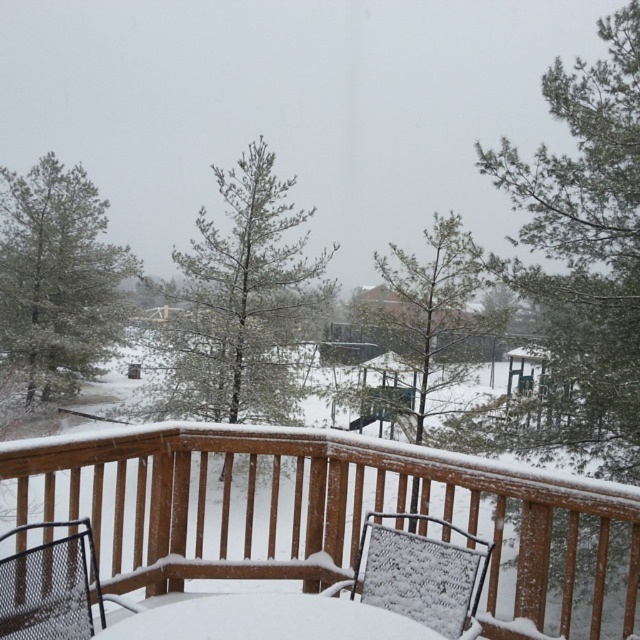
Does green matte tree at upper right appear under white mesh chair at center?

No.

Is green matte tree at upper right shorter than white mesh chair at center?

Correct, green matte tree at upper right is not as tall as white mesh chair at center.

I want to click on green matte tree at upper right, so click(x=586, y=244).

Is point (266, 452) less distant than point (81, 580)?

No, (266, 452) is behind (81, 580).

The height and width of the screenshot is (640, 640). Identify the location of snow-covered wooden balcony at center. (330, 515).

Between snow-covered pine tree at left and white snow-covered table at center, which one has more height?

Standing taller between the two is snow-covered pine tree at left.

What do you see at coordinates (58, 275) in the screenshot? The height and width of the screenshot is (640, 640). I see `snow-covered pine tree at left` at bounding box center [58, 275].

Image resolution: width=640 pixels, height=640 pixels. Identify the location of snow-covered pine tree at left. (58, 275).